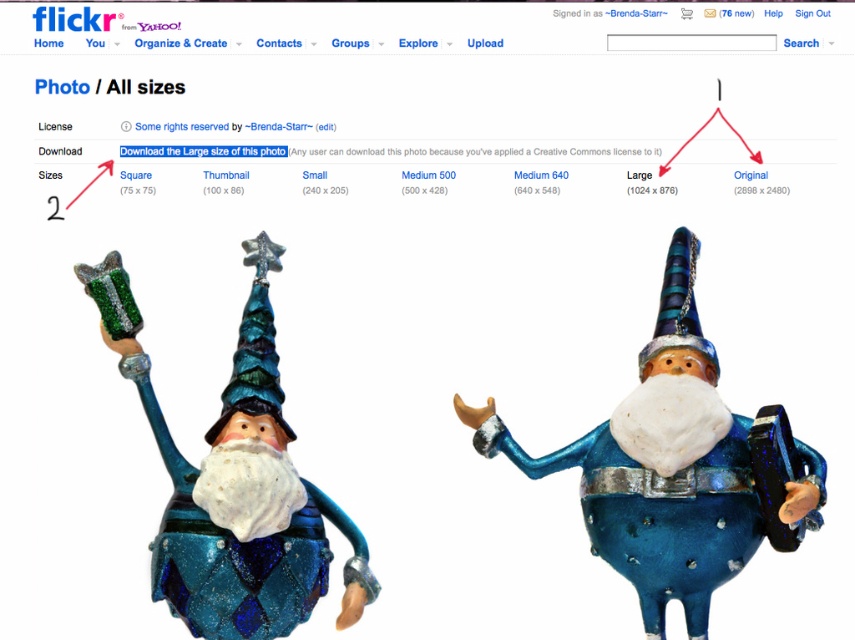
Question: Which object appears closest to the camera in this image?

Choices:
 (A) shiny blue glass gnome at center
 (B) matte blue glass gnome at center

Answer: (A)

Question: Which of the following is the farthest from the observer?

Choices:
 (A) (234, 564)
 (B) (632, 506)

Answer: (B)

Question: Can you confirm if matte blue glass gnome at center is smaller than shiny blue glass gnome at center?

Choices:
 (A) yes
 (B) no

Answer: (B)

Question: Can you confirm if matte blue glass gnome at center is positioned to the right of shiny blue glass gnome at center?

Choices:
 (A) no
 (B) yes

Answer: (B)

Question: Can you confirm if matte blue glass gnome at center is positioned below shiny blue glass gnome at center?

Choices:
 (A) no
 (B) yes

Answer: (A)

Question: Which of the following is the closest to the observer?

Choices:
 (A) shiny blue glass gnome at center
 (B) matte blue glass gnome at center

Answer: (A)